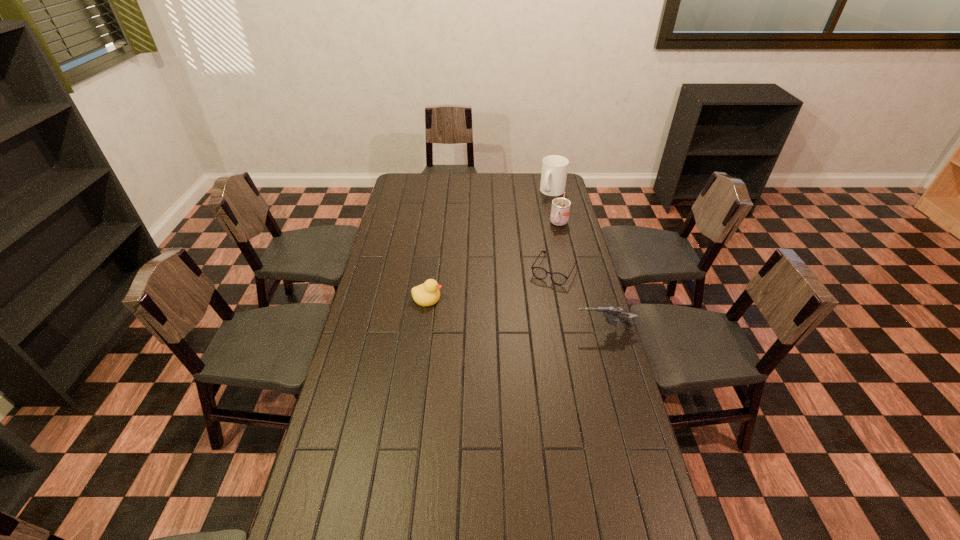
Find the location of a particular element. The image size is (960, 540). vacant area that lies between the duckling and the farthest object is located at coordinates (491, 245).

Identify the location of empty location between the fourth shortest object and the second shortest object. This screenshot has height=540, width=960. (493, 261).

The height and width of the screenshot is (540, 960). What are the coordinates of `vacant point located between the leftmost object and the fourth shortest object` in the screenshot? It's located at (493, 261).

Identify which object is located as the nearest to the duckling. Please provide its 2D coordinates. Your answer should be formatted as a tuple, i.e. [(x, y)], where the tuple contains the x and y coordinates of a point satisfying the conditions above.

[(540, 273)]

The image size is (960, 540). What are the coordinates of `object identified as the fourth closest to the duckling` in the screenshot? It's located at (554, 167).

The height and width of the screenshot is (540, 960). I want to click on vacant point that satisfies the following two spatial constraints: 1. on the front side of the third shortest object; 2. at the barrel of the cup, so click(x=584, y=329).

Where is `free space that satisfies the following two spatial constraints: 1. on the front side of the third tallest object; 2. at the barrel of the mug`? free space that satisfies the following two spatial constraints: 1. on the front side of the third tallest object; 2. at the barrel of the mug is located at coordinates (587, 329).

I want to click on blank space that satisfies the following two spatial constraints: 1. on the front side of the second tallest object; 2. at the barrel of the gun, so click(x=584, y=329).

At what (x,y) coordinates should I click in order to perform the action: click on free point that satisfies the following two spatial constraints: 1. on the front side of the third farthest object; 2. at the barrel of the nearest object. Please return your answer as a coordinate pair (x, y). This screenshot has width=960, height=540. Looking at the image, I should click on [x=566, y=329].

Identify the location of vacant area in the image that satisfies the following two spatial constraints: 1. on the back side of the farthest object; 2. on the left side of the fourth nearest object. (551, 192).